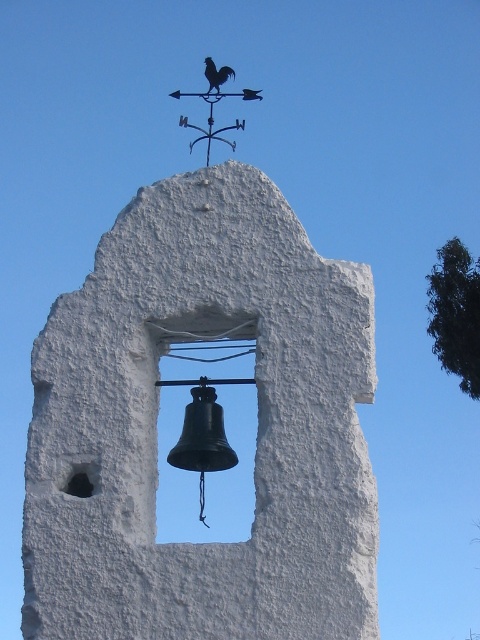
You are an architect examining the bell tower and notice the black metal weather vane at upper center and the shiny black rooster at upper center. Which object is located to the left of the other?

The black metal weather vane at upper center is positioned on the left side of shiny black rooster at upper center.

You are a maintenance worker checking the bell tower. You need to determine if the black metal weather vane at upper center can be replaced with a new one that requires a wider base. Based on the current setup, can the shiny black rooster at upper center be moved to accommodate the new weather vane?

The black metal weather vane at upper center might be wider than the shiny black rooster at upper center, so there is a possibility that the current weather vane already occupies the available space. Moving the shiny black rooster at upper center might be necessary to accommodate a wider base for the new weather vane.